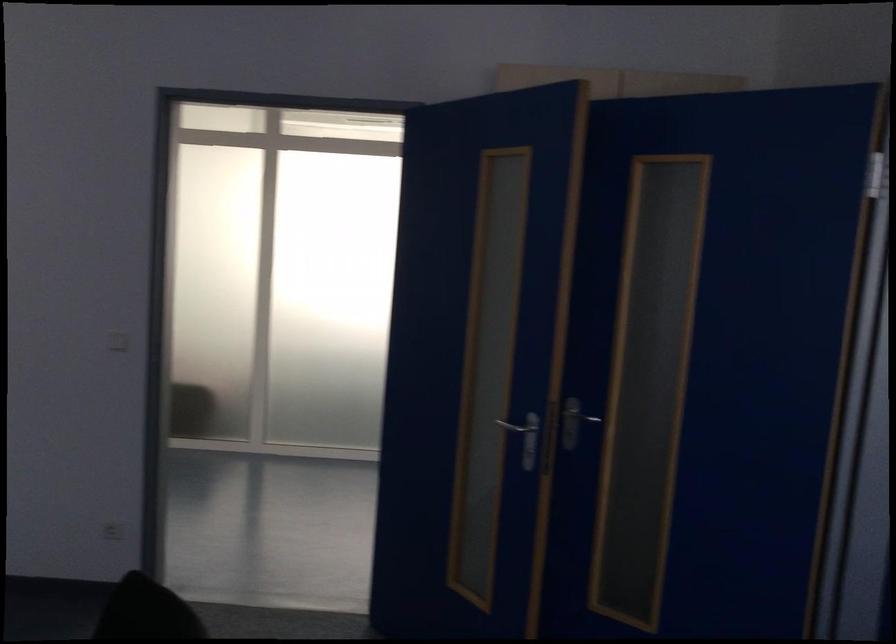
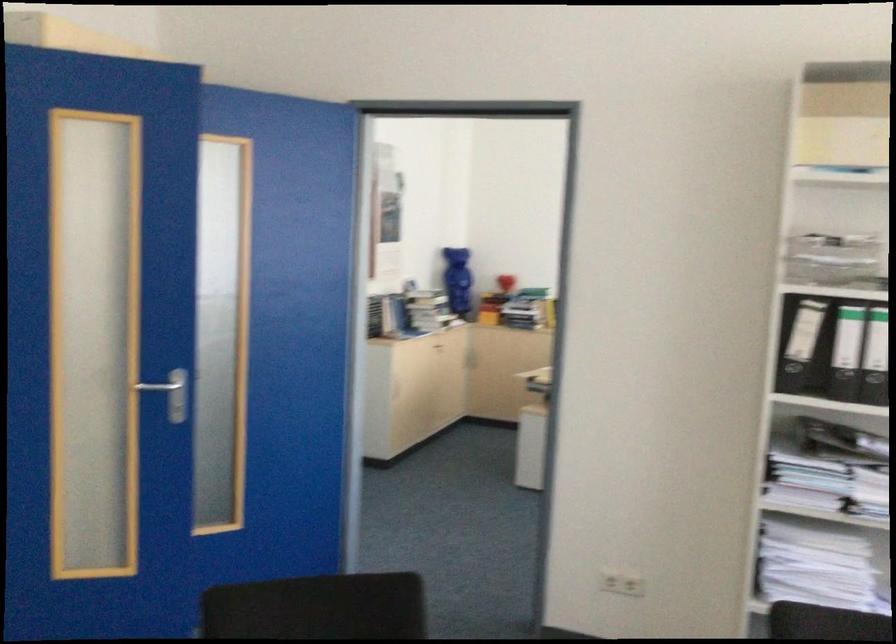
Where in the second image is the point corresponding to point (650, 459) from the first image?

(176, 398)